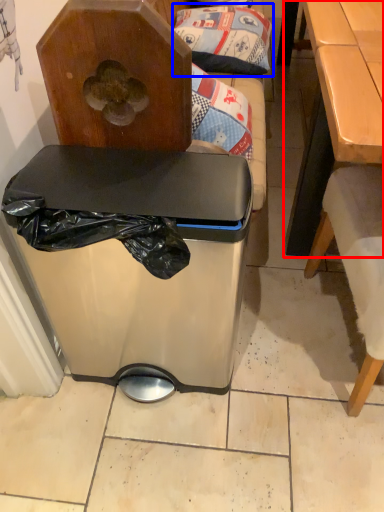
Question: Which object appears farthest to the camera in this image, table (highlighted by a red box) or pillow (highlighted by a blue box)?

Choices:
 (A) table
 (B) pillow

Answer: (B)